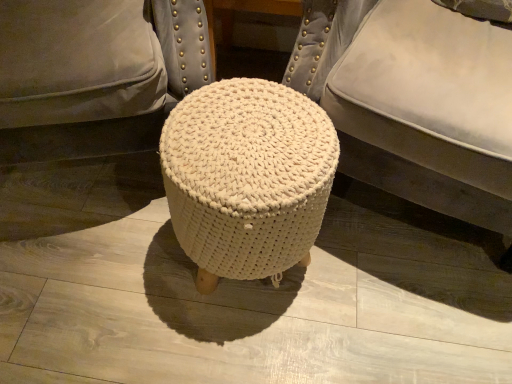
Identify the location of free point above white knitted stool at center (from a real-world perspective). This screenshot has height=384, width=512. (237, 145).